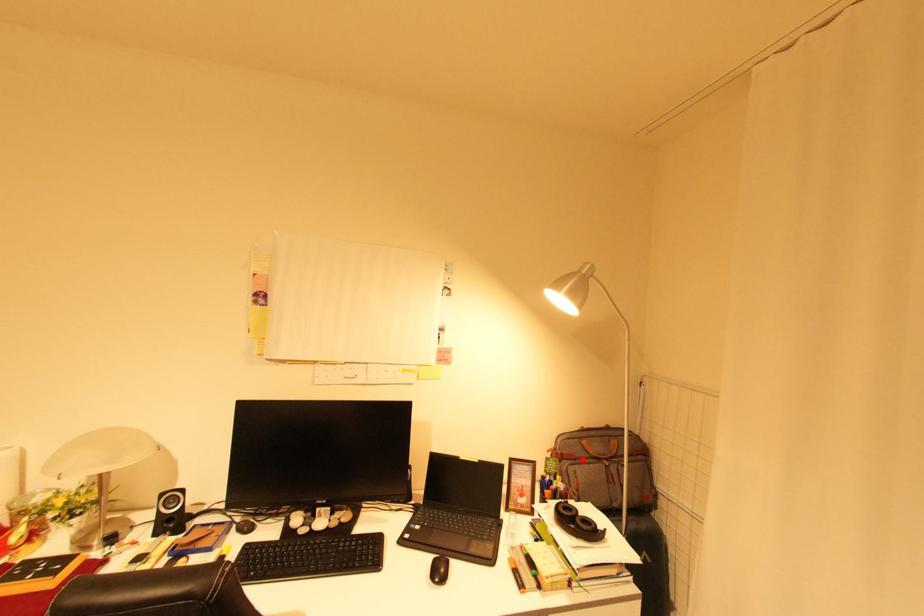
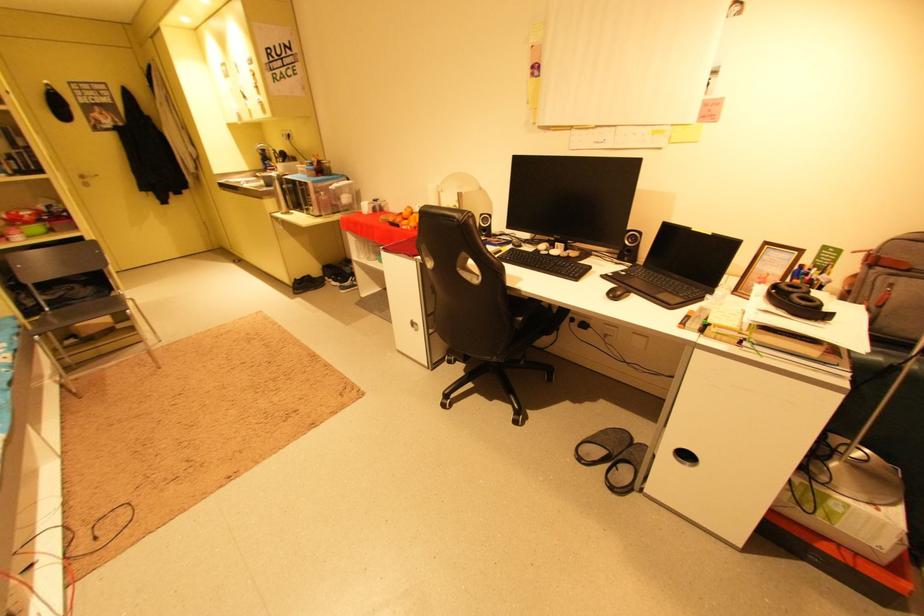
Find the pixel in the second image that matches the highlighted location in the first image.

(917, 272)